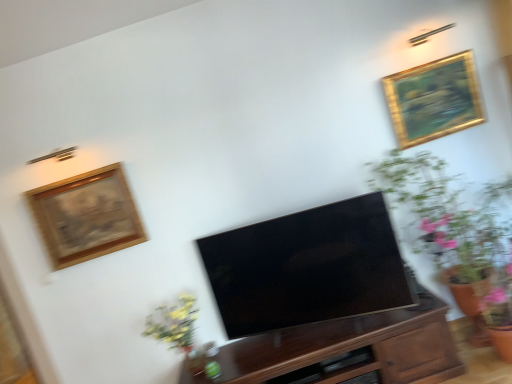
What do you see at coordinates (348, 373) in the screenshot?
I see `wooden drawer at center` at bounding box center [348, 373].

Measure the distance between point [475,77] and camera.

A distance of 9.23 feet exists between point [475,77] and camera.

Locate an element on the screen. The width and height of the screenshot is (512, 384). dark wood cabinet at center is located at coordinates (345, 350).

Measure the distance between point (412, 340) and camera.

Point (412, 340) is 8.20 feet from camera.

Where is `green leafy plant at right`? The width and height of the screenshot is (512, 384). green leafy plant at right is located at coordinates (450, 227).

The image size is (512, 384). I want to click on matte black tv at center, so click(x=307, y=267).

From a real-world perspective, which is physically below, wooden drawer at center or dark wood cabinet at center?

wooden drawer at center is physically lower.

In the image, is wooden drawer at center on the left side or the right side of dark wood cabinet at center?

From the image, it's evident that wooden drawer at center is to the right of dark wood cabinet at center.

Looking at this image, is dark wood cabinet at center at the back of wooden drawer at center?

Yes, wooden drawer at center's orientation is away from dark wood cabinet at center.

Which of these two, wooden drawer at center or gold/gilded picture frame at upper right, the second picture frame from the left, is bigger?

gold/gilded picture frame at upper right, the second picture frame from the left.

Based on the photo, how far apart are wooden drawer at center and gold/gilded picture frame at upper right, acting as the 1th picture frame starting from the right?

The distance of wooden drawer at center from gold/gilded picture frame at upper right, acting as the 1th picture frame starting from the right, is 5.50 feet.

From the image's perspective, starting from the wooden drawer at center, which picture frame is the 2nd one above? Please provide its 2D coordinates.

[(434, 99)]

Between point (337, 379) and point (406, 125), which one is positioned behind?

The point (406, 125) is more distant.

The height and width of the screenshot is (384, 512). In order to click on houseplant on the right of wooden framed artwork at upper left, the first picture frame positioned from the left in this screenshot , I will do `click(450, 227)`.

Is green leafy plant at right looking in the opposite direction of wooden framed artwork at upper left, the first picture frame positioned from the left?

green leafy plant at right does not have its back to wooden framed artwork at upper left, the first picture frame positioned from the left.

Is point (462, 256) more distant than point (52, 196)?

No, (462, 256) is in front of (52, 196).

Can you confirm if green leafy plant at right is smaller than wooden framed artwork at upper left, marked as the second picture frame in a right-to-left arrangement?

Actually, green leafy plant at right might be larger than wooden framed artwork at upper left, marked as the second picture frame in a right-to-left arrangement.

Is dark wood cabinet at center not within green leafy plant at right?

Yes, dark wood cabinet at center is outside of green leafy plant at right.

Is the position of dark wood cabinet at center more distant than that of green leafy plant at right?

Yes, it is.

Is dark wood cabinet at center far away from green leafy plant at right?

dark wood cabinet at center is near green leafy plant at right, not far away.

Which of these two, dark wood cabinet at center or green leafy plant at right, is smaller?

Smaller between the two is dark wood cabinet at center.

Considering the sizes of objects matte black tv at center and wooden drawer at center in the image provided, who is wider, matte black tv at center or wooden drawer at center?

wooden drawer at center.

In terms of height, does matte black tv at center look taller or shorter compared to wooden drawer at center?

matte black tv at center is taller than wooden drawer at center.

This screenshot has height=384, width=512. I want to click on television that appears above the wooden drawer at center (from the image's perspective), so click(x=307, y=267).

Is dark wood cabinet at center not near matte black tv at center?

No, dark wood cabinet at center is not far away from matte black tv at center.

Consider the image. Can you tell me how much dark wood cabinet at center and matte black tv at center differ in facing direction?

They differ by 18.1 degrees in their facing directions.

In the scene shown: From a real-world perspective, between dark wood cabinet at center and matte black tv at center, who is vertically lower?

dark wood cabinet at center is physically lower.

Considering the sizes of objects dark wood cabinet at center and matte black tv at center in the image provided, who is wider, dark wood cabinet at center or matte black tv at center?

dark wood cabinet at center is wider.

From the image's perspective, which is above, dark wood cabinet at center or wooden framed artwork at upper left, which is counted as the second picture frame, starting from the top?

wooden framed artwork at upper left, which is counted as the second picture frame, starting from the top.

Between dark wood cabinet at center and wooden framed artwork at upper left, the first picture frame positioned from the left, which one has larger width?

dark wood cabinet at center is wider.

From a real-world perspective, is dark wood cabinet at center physically located above or below wooden framed artwork at upper left, which is counted as the second picture frame, starting from the top?

dark wood cabinet at center is below wooden framed artwork at upper left, which is counted as the second picture frame, starting from the top.

Which point is more distant from viewer, (387,360) or (106,200)?

Positioned behind is point (106,200).

Find the location of `drawer below the dark wood cabinet at center (from the image's perspective)`. drawer below the dark wood cabinet at center (from the image's perspective) is located at coordinates (348, 373).

Where is `drawer lying in front of the gold/gilded picture frame at upper right, the first picture frame viewed from the top`? Image resolution: width=512 pixels, height=384 pixels. drawer lying in front of the gold/gilded picture frame at upper right, the first picture frame viewed from the top is located at coordinates (348, 373).

Looking at the image, which one is located closer to green leafy plant at right, matte black tv at center or wooden framed artwork at upper left, the first picture frame positioned from the left?

Based on the image, matte black tv at center appears to be nearer to green leafy plant at right.

From the image, which object appears to be nearer to gold/gilded picture frame at upper right, the first picture frame viewed from the top, matte black tv at center or wooden drawer at center?

Among the two, matte black tv at center is located nearer to gold/gilded picture frame at upper right, the first picture frame viewed from the top.

Looking at the image, which one is located further to matte black tv at center, wooden drawer at center or wooden framed artwork at upper left, which is counted as the second picture frame, starting from the top?

Based on the image, wooden framed artwork at upper left, which is counted as the second picture frame, starting from the top, appears to be further to matte black tv at center.

Estimate the real-world distances between objects in this image. Which object is closer to matte black tv at center, wooden framed artwork at upper left, the first picture frame positioned from the bottom, or green leafy plant at right?

green leafy plant at right is positioned closer to the anchor matte black tv at center.

Which object lies nearer to the anchor point wooden drawer at center, wooden framed artwork at upper left, the first picture frame positioned from the bottom, or green leafy plant at right?

green leafy plant at right is positioned closer to the anchor wooden drawer at center.

Considering their positions, is wooden drawer at center positioned closer to wooden framed artwork at upper left, marked as the second picture frame in a right-to-left arrangement, than matte black tv at center?

The object closer to wooden framed artwork at upper left, marked as the second picture frame in a right-to-left arrangement, is matte black tv at center.

From the image, which object appears to be farther from dark wood cabinet at center, green leafy plant at right or matte black tv at center?

The object further to dark wood cabinet at center is green leafy plant at right.

In the scene shown: Looking at the image, which one is located closer to green leafy plant at right, wooden framed artwork at upper left, the first picture frame positioned from the bottom, or matte black tv at center?

Based on the image, matte black tv at center appears to be nearer to green leafy plant at right.

The image size is (512, 384). What are the coordinates of `drawer located between wooden framed artwork at upper left, which is counted as the second picture frame, starting from the top, and green leafy plant at right in the left-right direction` in the screenshot? It's located at (348, 373).

Where is `cabinetry located between wooden framed artwork at upper left, the first picture frame positioned from the left, and gold/gilded picture frame at upper right, the first picture frame viewed from the top, in the left-right direction`? cabinetry located between wooden framed artwork at upper left, the first picture frame positioned from the left, and gold/gilded picture frame at upper right, the first picture frame viewed from the top, in the left-right direction is located at coordinates (345, 350).

Identify the location of houseplant between gold/gilded picture frame at upper right, the second picture frame from the left, and matte black tv at center vertically. The width and height of the screenshot is (512, 384). (450, 227).

This screenshot has height=384, width=512. I want to click on television between gold/gilded picture frame at upper right, acting as the 1th picture frame starting from the right, and wooden drawer at center in the up-down direction, so click(307, 267).